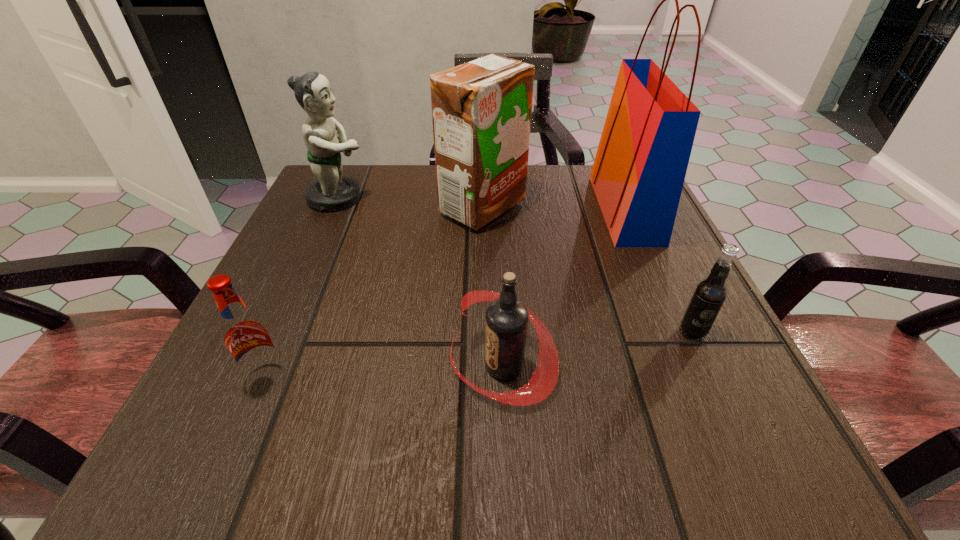
Locate an element on the screen. free space at the left edge is located at coordinates (219, 364).

Identify the location of vacant space at the right edge of the desktop. Image resolution: width=960 pixels, height=540 pixels. (606, 271).

This screenshot has width=960, height=540. What are the coordinates of `free space at the far left corner` in the screenshot? It's located at 350,169.

Locate an element on the screen. This screenshot has width=960, height=540. vacant space at the near left corner of the desktop is located at coordinates (247, 409).

In the image, there is a desktop. Find the location of `vacant space at the far right corner`. vacant space at the far right corner is located at coordinates (574, 170).

The width and height of the screenshot is (960, 540). In order to click on free space at the near right corner in this screenshot , I will do `click(690, 412)`.

Locate an element on the screen. free spot between the leftmost root beer and the figurine is located at coordinates (302, 287).

This screenshot has height=540, width=960. In order to click on free space between the rightmost root beer and the leftmost root beer in this screenshot , I will do `click(480, 354)`.

Where is `vacant area that lies between the second root beer from right to left and the carton`? The width and height of the screenshot is (960, 540). vacant area that lies between the second root beer from right to left and the carton is located at coordinates (492, 287).

Image resolution: width=960 pixels, height=540 pixels. I want to click on vacant space that's between the leftmost root beer and the tallest object, so click(445, 293).